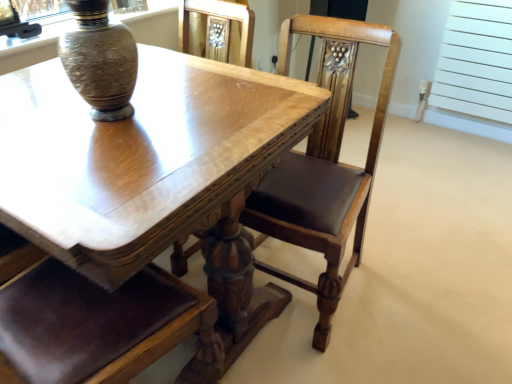
Question: Considering the relative positions of shiny wood table at center and speckled ceramic vase at upper left in the image provided, is shiny wood table at center in front of speckled ceramic vase at upper left?

Choices:
 (A) no
 (B) yes

Answer: (B)

Question: From the image's perspective, is shiny wood table at center located above speckled ceramic vase at upper left?

Choices:
 (A) yes
 (B) no

Answer: (B)

Question: Can you see shiny wood table at center touching speckled ceramic vase at upper left?

Choices:
 (A) no
 (B) yes

Answer: (A)

Question: Does shiny wood table at center appear on the right side of speckled ceramic vase at upper left?

Choices:
 (A) no
 (B) yes

Answer: (A)

Question: Is shiny wood table at center looking in the opposite direction of speckled ceramic vase at upper left?

Choices:
 (A) no
 (B) yes

Answer: (A)

Question: Is shiny wood table at center taller than speckled ceramic vase at upper left?

Choices:
 (A) no
 (B) yes

Answer: (B)

Question: From the image's perspective, does polished wood chair at center appear lower than white matte radiator at upper right?

Choices:
 (A) no
 (B) yes

Answer: (B)

Question: Are polished wood chair at center and white matte radiator at upper right located far from each other?

Choices:
 (A) yes
 (B) no

Answer: (A)

Question: Can you confirm if polished wood chair at center is bigger than white matte radiator at upper right?

Choices:
 (A) yes
 (B) no

Answer: (A)

Question: Is the depth of polished wood chair at center less than that of white matte radiator at upper right?

Choices:
 (A) no
 (B) yes

Answer: (B)

Question: Is polished wood chair at center behind white matte radiator at upper right?

Choices:
 (A) yes
 (B) no

Answer: (B)

Question: Does polished wood chair at center turn towards white matte radiator at upper right?

Choices:
 (A) yes
 (B) no

Answer: (B)

Question: Is white matte radiator at upper right not near polished wood chair at center?

Choices:
 (A) yes
 (B) no

Answer: (A)